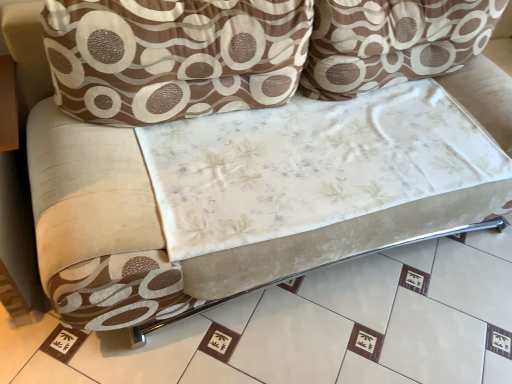
Question: From the image's perspective, is white fabric at center beneath brown textured pillow at upper center, placed as the second throw pillow when sorted from right to left?

Choices:
 (A) no
 (B) yes

Answer: (B)

Question: Is there a large distance between white fabric at center and brown textured pillow at upper center, placed as the second throw pillow when sorted from right to left?

Choices:
 (A) yes
 (B) no

Answer: (B)

Question: Can we say white fabric at center lies outside brown textured pillow at upper center, the first throw pillow in the left-to-right sequence?

Choices:
 (A) yes
 (B) no

Answer: (A)

Question: Can you confirm if white fabric at center is smaller than brown textured pillow at upper center, placed as the second throw pillow when sorted from right to left?

Choices:
 (A) yes
 (B) no

Answer: (B)

Question: From a real-world perspective, is white fabric at center under brown textured pillow at upper center, placed as the second throw pillow when sorted from right to left?

Choices:
 (A) yes
 (B) no

Answer: (A)

Question: Can you confirm if white fabric at center is taller than brown textured pillow at upper center, placed as the second throw pillow when sorted from right to left?

Choices:
 (A) yes
 (B) no

Answer: (B)

Question: Is brown textured pillow at upper center, placed as the second throw pillow when sorted from right to left, at the left side of white fabric at center?

Choices:
 (A) no
 (B) yes

Answer: (B)

Question: From a real-world perspective, does brown textured pillow at upper center, the first throw pillow in the left-to-right sequence, stand above white fabric at center?

Choices:
 (A) no
 (B) yes

Answer: (B)

Question: Is brown textured pillow at upper center, placed as the second throw pillow when sorted from right to left, taller than white fabric at center?

Choices:
 (A) no
 (B) yes

Answer: (B)

Question: Is brown textured pillow at upper center, the first throw pillow in the left-to-right sequence, outside white fabric at center?

Choices:
 (A) no
 (B) yes

Answer: (B)

Question: Considering the relative positions of brown textured pillow at upper center, the first throw pillow in the left-to-right sequence, and white fabric at center in the image provided, is brown textured pillow at upper center, the first throw pillow in the left-to-right sequence, behind white fabric at center?

Choices:
 (A) yes
 (B) no

Answer: (A)

Question: Is brown textured pillow at upper center, placed as the second throw pillow when sorted from right to left, oriented towards white fabric at center?

Choices:
 (A) no
 (B) yes

Answer: (A)

Question: Is brown textured pillow at upper center, placed as the second throw pillow when sorted from right to left, closer to the viewer compared to brown textured pillow at upper center, which is the 1th throw pillow from right to left?

Choices:
 (A) yes
 (B) no

Answer: (A)